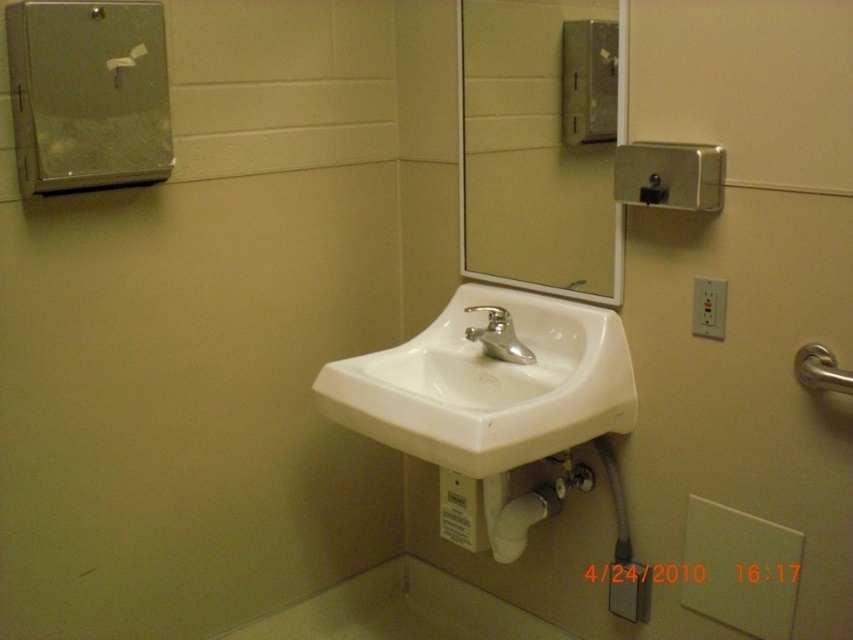
You are a maintenance worker checking the restroom facilities. You need to clean both the clear glass mirror at upper center and the satin nickel faucet at center. According to the image, which object is located above the other?

The clear glass mirror at upper center is positioned over the satin nickel faucet at center, so the mirror is above the faucet.

You are standing in front of the restroom sink and want to reach two points marked on the wall. The first point is at coordinate point(578, 58) and the second point is at coordinate point(570, 289). Which point is closer to you?

Point(578, 58) is closer to the camera than point(570, 289), so the first point is closer to you.

You are a maintenance worker checking the restroom facilities. You need to determine which object is taller between the satin nickel soap dispenser at upper center and the silver metallic faucet at center. Based on the scene, which one is taller?

The satin nickel soap dispenser at upper center is much taller than the silver metallic faucet at center.